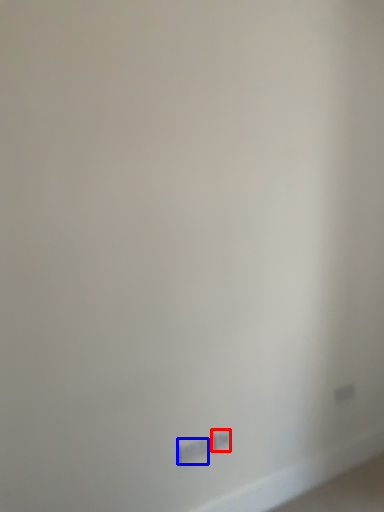
Question: Which of the following is the farthest to the observer, power plugs and sockets (highlighted by a red box) or power plugs and sockets (highlighted by a blue box)?

Choices:
 (A) power plugs and sockets
 (B) power plugs and sockets

Answer: (A)